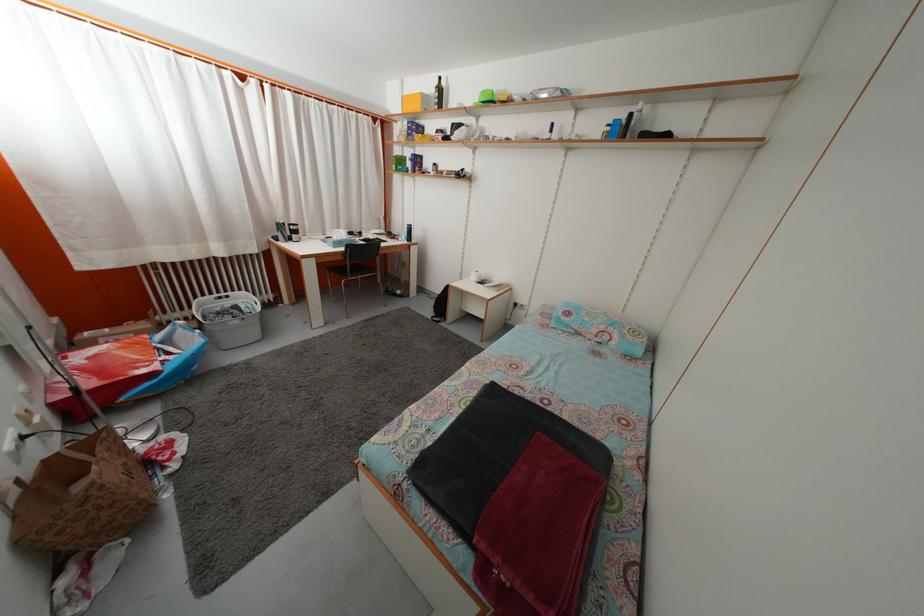
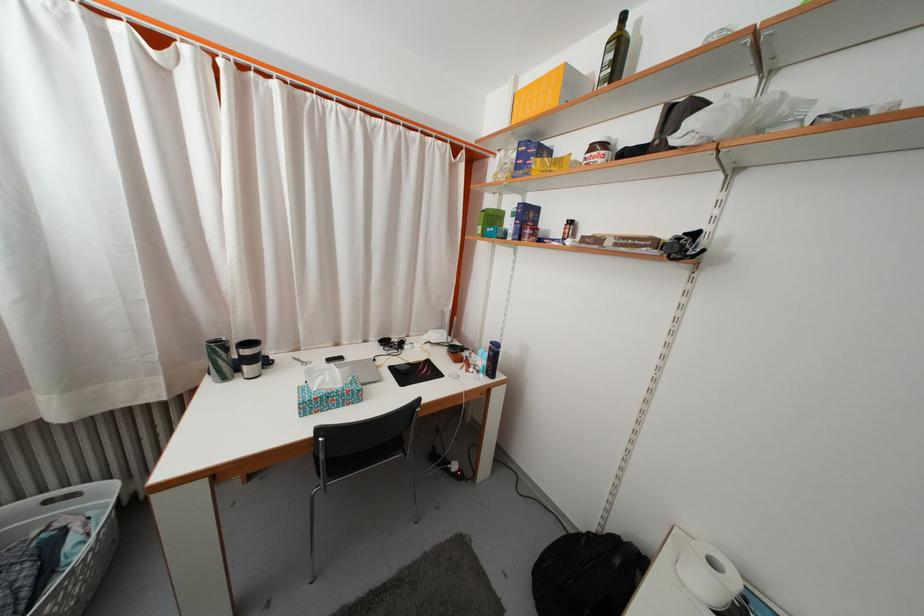
Locate, in the second image, the point that corresponds to the point at 407,168 in the first image.

(500, 225)